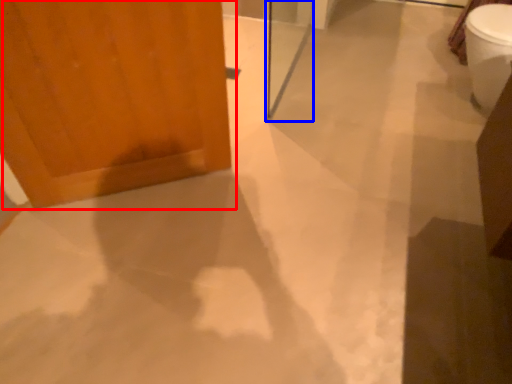
Question: Which object is closer to the camera taking this photo, door (highlighted by a red box) or screen door (highlighted by a blue box)?

Choices:
 (A) door
 (B) screen door

Answer: (A)